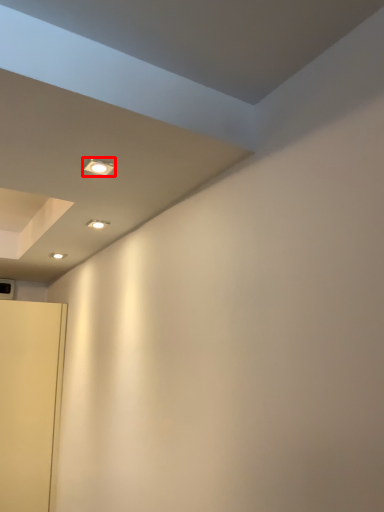
Question: From the image's perspective, where is light fixture (annotated by the red box) located relative to door?

Choices:
 (A) above
 (B) below

Answer: (A)